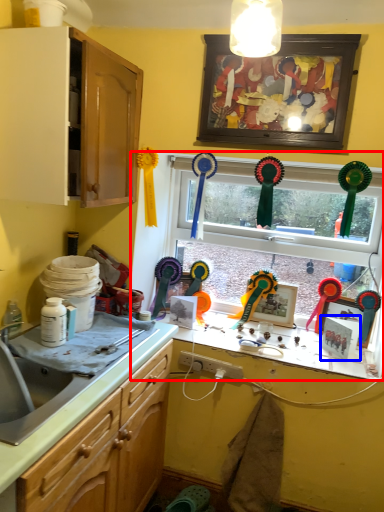
Question: Which of the following is the closest to the observer, window (highlighted by a red box) or picture frame (highlighted by a blue box)?

Choices:
 (A) window
 (B) picture frame

Answer: (B)